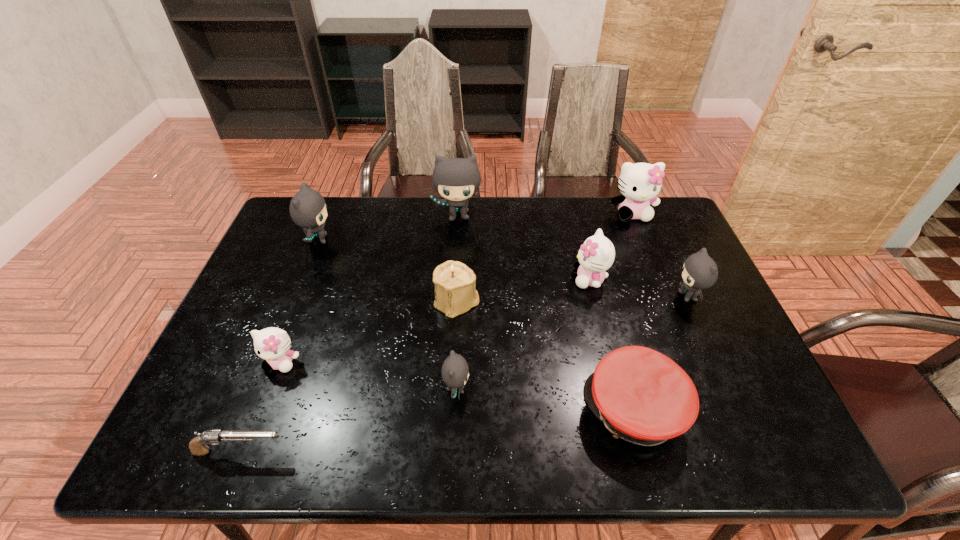
Locate an element on the screen. the biggest gray kitten is located at coordinates (456, 179).

Where is `the farthest white kitten`? the farthest white kitten is located at coordinates (639, 183).

You are a GUI agent. You are given a task and a screenshot of the screen. Output one action in this format:
    pyautogui.click(x=<x>, y=<y>)
    Task: Click on the biggest white kitten
    This screenshot has height=540, width=960.
    Given the screenshot: What is the action you would take?
    click(x=639, y=183)

At what (x,y) coordinates should I click in order to perform the action: click on the leftmost gray kitten. Please return your answer as a coordinate pair (x, y). The image size is (960, 540). Looking at the image, I should click on (308, 209).

Identify the location of the second white kitten from right to left. (596, 255).

Locate an element on the screen. The height and width of the screenshot is (540, 960). the third kitten from right to left is located at coordinates (596, 255).

Find the location of a particular element. The image size is (960, 540). candle_holder is located at coordinates (455, 289).

The image size is (960, 540). I want to click on the third farthest gray kitten, so click(700, 271).

Find the location of a particular element. the rightmost gray kitten is located at coordinates (700, 271).

Locate an element on the screen. Image resolution: width=960 pixels, height=540 pixels. the leftmost white kitten is located at coordinates click(x=273, y=344).